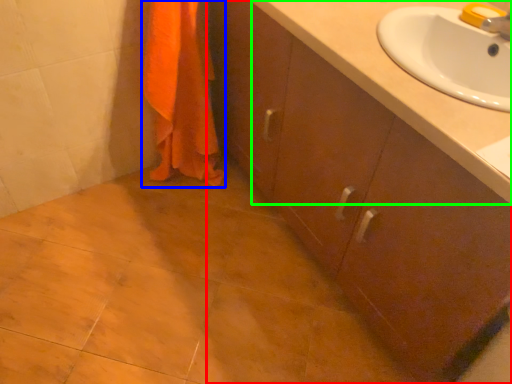
Question: Considering the real-world distances, which object is farthest from bathroom cabinet (highlighted by a red box)? bath towel (highlighted by a blue box) or counter top (highlighted by a green box)?

Choices:
 (A) bath towel
 (B) counter top

Answer: (A)